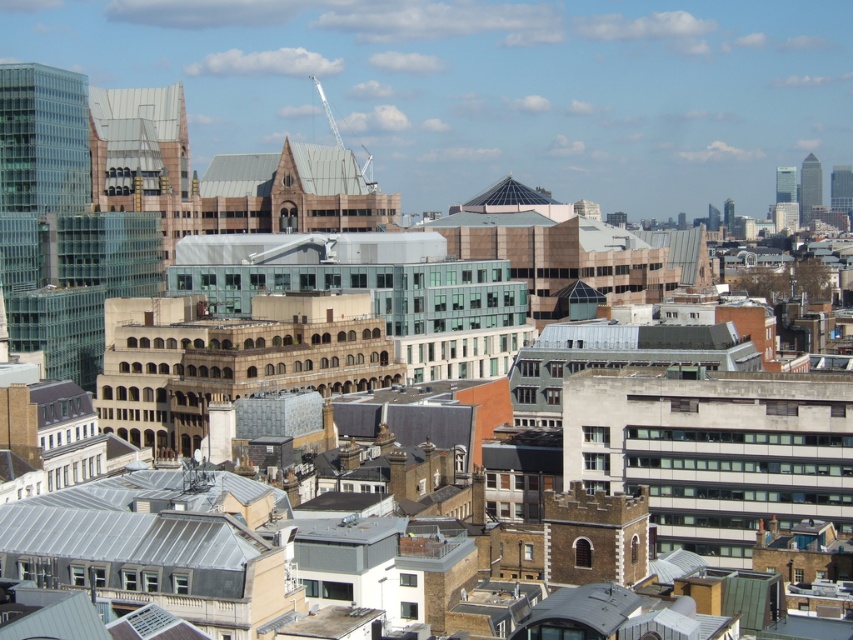
Is the position of glassy steel skyscraper at right less distant than that of glassy skyscraper at upper right?

Yes, it is.

Consider the image. Which of these two, glassy steel skyscraper at right or glassy skyscraper at upper right, stands shorter?

glassy skyscraper at upper right

Between point (840, 193) and point (786, 200), which one is positioned behind?

Point (786, 200)

Identify the location of glassy steel skyscraper at right. (840, 189).

Who is positioned more to the right, glassy silver skyscraper at upper right or glassy skyscraper at upper right?

Positioned to the right is glassy silver skyscraper at upper right.

Locate an element on the screen. The height and width of the screenshot is (640, 853). glassy silver skyscraper at upper right is located at coordinates (809, 186).

Can you confirm if glassy silver skyscraper at upper right is bigger than glassy steel skyscraper at right?

No.

How far apart are glassy silver skyscraper at upper right and glassy steel skyscraper at right?

glassy silver skyscraper at upper right and glassy steel skyscraper at right are 32.33 feet apart.

Does point (802, 225) lie in front of point (837, 177)?

That is False.

The width and height of the screenshot is (853, 640). I want to click on glassy silver skyscraper at upper right, so click(809, 186).